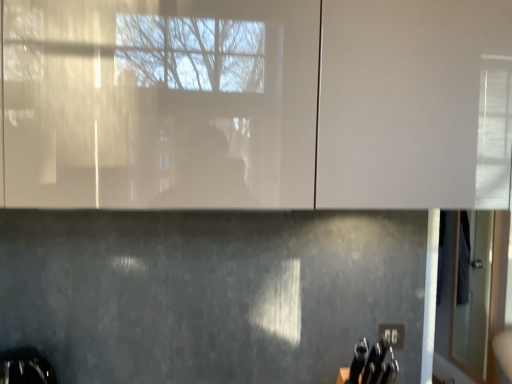
The width and height of the screenshot is (512, 384). Identify the location of glossy white cabinet at upper center. (132, 100).

Describe the element at coordinates (132, 100) in the screenshot. The image size is (512, 384). I see `glossy white cabinet at upper center` at that location.

Locate an element on the screen. The height and width of the screenshot is (384, 512). glossy white cabinet at upper center is located at coordinates (132, 100).